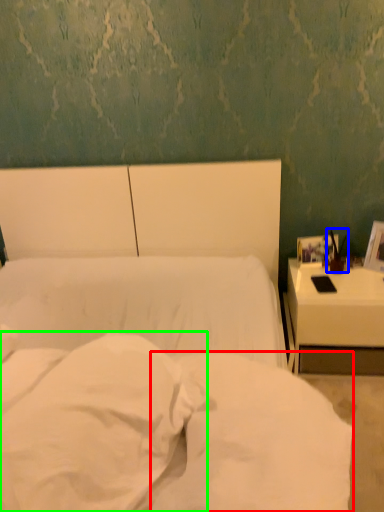
Question: Estimate the real-world distances between objects in this image. Which object is farther from sheet (highlighted by a red box), bedside lamp (highlighted by a blue box) or pillow (highlighted by a green box)?

Choices:
 (A) bedside lamp
 (B) pillow

Answer: (A)